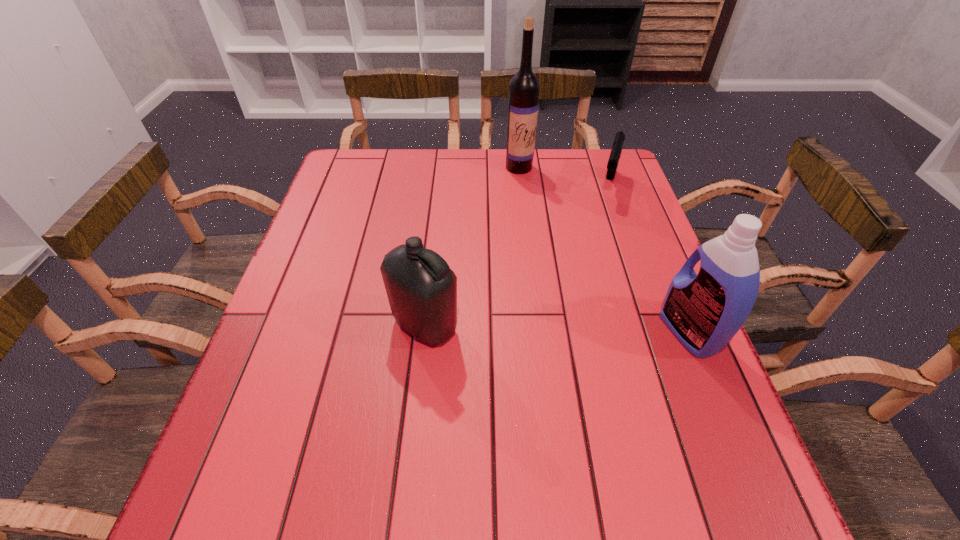
The height and width of the screenshot is (540, 960). Identify the location of free spot on the desktop that is between the leftmost object and the detergent and is positioned on the label of the tallest object. (584, 329).

I want to click on free space on the desktop that is between the third tallest object and the detergent and is positioned at the barrel of the shortest object, so click(569, 329).